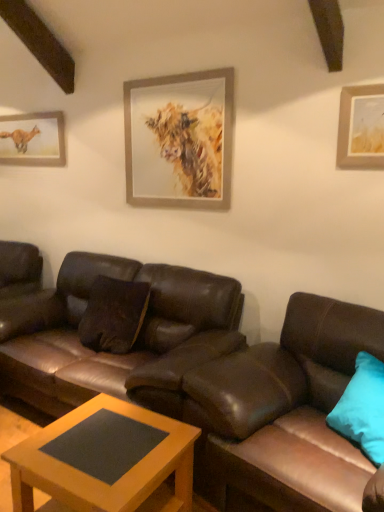
Question: Is matte paper picture frame at upper left, marked as the first picture frame in a back-to-front arrangement, oriented towards teal fabric pillow at right?

Choices:
 (A) yes
 (B) no

Answer: (B)

Question: Is matte paper picture frame at upper left, which ranks as the 2th picture frame in right-to-left order, bigger than teal fabric pillow at right?

Choices:
 (A) yes
 (B) no

Answer: (B)

Question: Is matte paper picture frame at upper left, which appears as the first picture frame when viewed from the left, smaller than teal fabric pillow at right?

Choices:
 (A) no
 (B) yes

Answer: (B)

Question: Does matte paper picture frame at upper left, marked as the first picture frame in a back-to-front arrangement, appear on the left side of teal fabric pillow at right?

Choices:
 (A) yes
 (B) no

Answer: (A)

Question: Can you confirm if matte paper picture frame at upper left, marked as the first picture frame in a back-to-front arrangement, is positioned to the right of teal fabric pillow at right?

Choices:
 (A) yes
 (B) no

Answer: (B)

Question: Relative to matte paper picture frame at upper left, acting as the second picture frame starting from the front, is teal fabric pillow at right in front or behind?

Choices:
 (A) behind
 (B) front

Answer: (B)

Question: Is point (370, 417) positioned closer to the camera than point (54, 116)?

Choices:
 (A) closer
 (B) farther

Answer: (A)

Question: In terms of height, does teal fabric pillow at right look taller or shorter compared to matte paper picture frame at upper left, marked as the first picture frame in a back-to-front arrangement?

Choices:
 (A) short
 (B) tall

Answer: (B)

Question: From a real-world perspective, is teal fabric pillow at right above or below matte paper picture frame at upper left, marked as the first picture frame in a back-to-front arrangement?

Choices:
 (A) above
 (B) below

Answer: (B)

Question: Relative to brown leather couch at center, which is the first studio couch from left to right, is wooden-framed painting of a cow at upper center, which is the 2th picture frame from back to front, in front or behind?

Choices:
 (A) front
 (B) behind

Answer: (B)

Question: In terms of width, does wooden-framed painting of a cow at upper center, which is the 2th picture frame from back to front, look wider or thinner when compared to brown leather couch at center, which is the first studio couch from left to right?

Choices:
 (A) thin
 (B) wide

Answer: (A)

Question: From a real-world perspective, is wooden-framed painting of a cow at upper center, which is the 2th picture frame from back to front, above or below brown leather couch at center, which ranks as the second studio couch in right-to-left order?

Choices:
 (A) below
 (B) above

Answer: (B)

Question: Considering the positions of wooden-framed painting of a cow at upper center, the first picture frame positioned from the right, and brown leather couch at center, which is the first studio couch from left to right, in the image, is wooden-framed painting of a cow at upper center, the first picture frame positioned from the right, bigger or smaller than brown leather couch at center, which is the first studio couch from left to right,?

Choices:
 (A) big
 (B) small

Answer: (B)

Question: Is brown leather couch at lower right, arranged as the first studio couch when viewed from the right, bigger or smaller than brown leather couch at center, which ranks as the second studio couch in right-to-left order?

Choices:
 (A) big
 (B) small

Answer: (B)

Question: Is brown leather couch at lower right, arranged as the first studio couch when viewed from the right, inside the boundaries of brown leather couch at center, which is the first studio couch from left to right, or outside?

Choices:
 (A) inside
 (B) outside

Answer: (B)